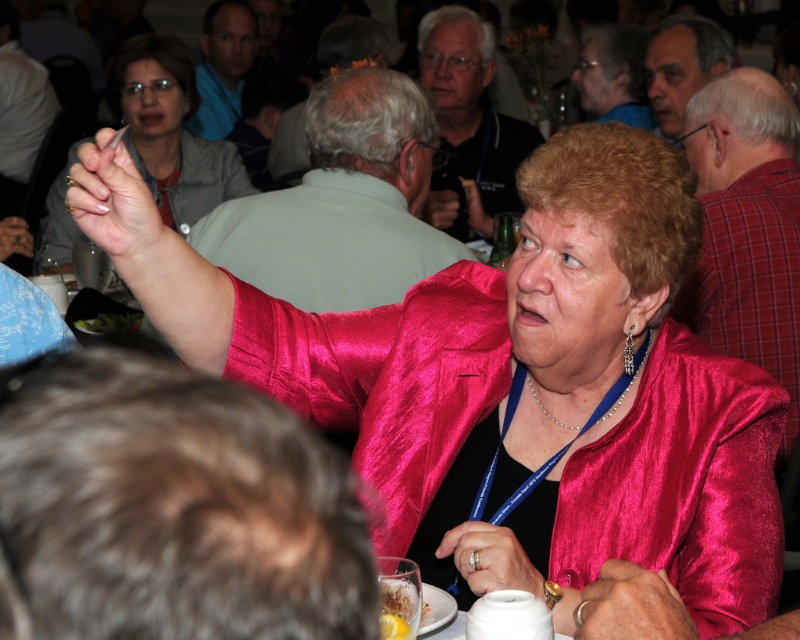
Image resolution: width=800 pixels, height=640 pixels. What do you see at coordinates (388, 332) in the screenshot? I see `shiny pink jacket at center` at bounding box center [388, 332].

Which is behind, point (604, 336) or point (410, 605)?

Positioned behind is point (604, 336).

Where is `shiny pink jacket at center`? The height and width of the screenshot is (640, 800). shiny pink jacket at center is located at coordinates (388, 332).

Is shiny pink jacket at center wider than shiny pink robe at center?

Correct, the width of shiny pink jacket at center exceeds that of shiny pink robe at center.

Image resolution: width=800 pixels, height=640 pixels. Describe the element at coordinates (388, 332) in the screenshot. I see `shiny pink jacket at center` at that location.

Does point (716, 534) lie in front of point (308, 285)?

That is True.

Where is `shiny pink jacket at center`? This screenshot has height=640, width=800. shiny pink jacket at center is located at coordinates (388, 332).

Can you confirm if shiny pink jacket at center is bigger than green leafy vegetable at upper left?

Indeed, shiny pink jacket at center has a larger size compared to green leafy vegetable at upper left.

Does shiny pink jacket at center lie in front of green leafy vegetable at upper left?

Yes, shiny pink jacket at center is in front of green leafy vegetable at upper left.

The image size is (800, 640). What do you see at coordinates (388, 332) in the screenshot?
I see `shiny pink jacket at center` at bounding box center [388, 332].

Identify the location of shiny pink jacket at center. (388, 332).